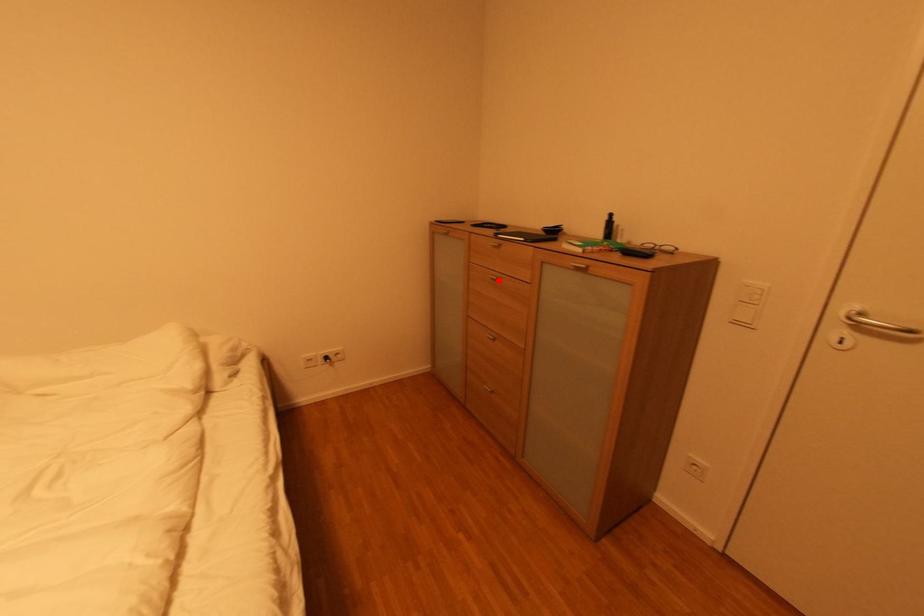
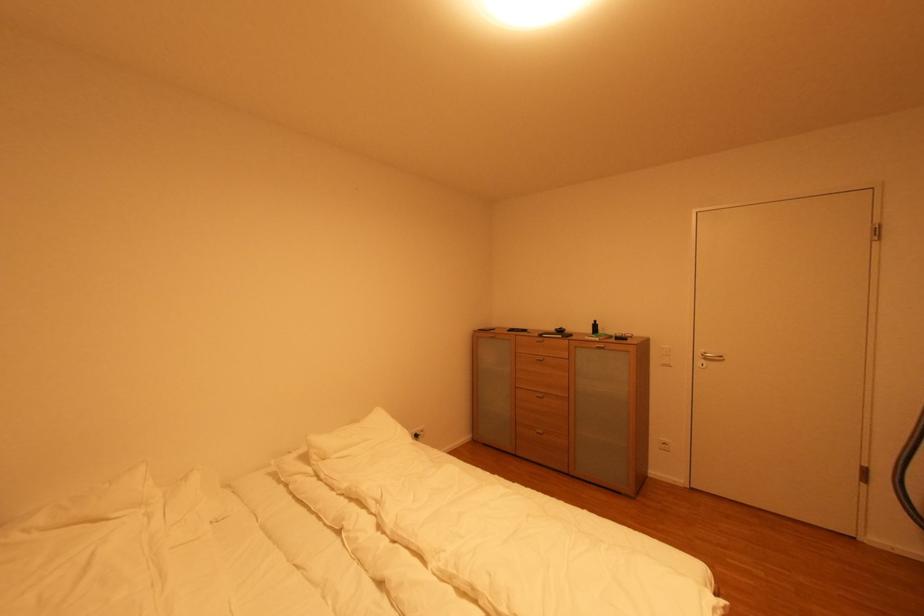
In the second image, find the point that corresponds to the highlighted location in the first image.

(543, 361)